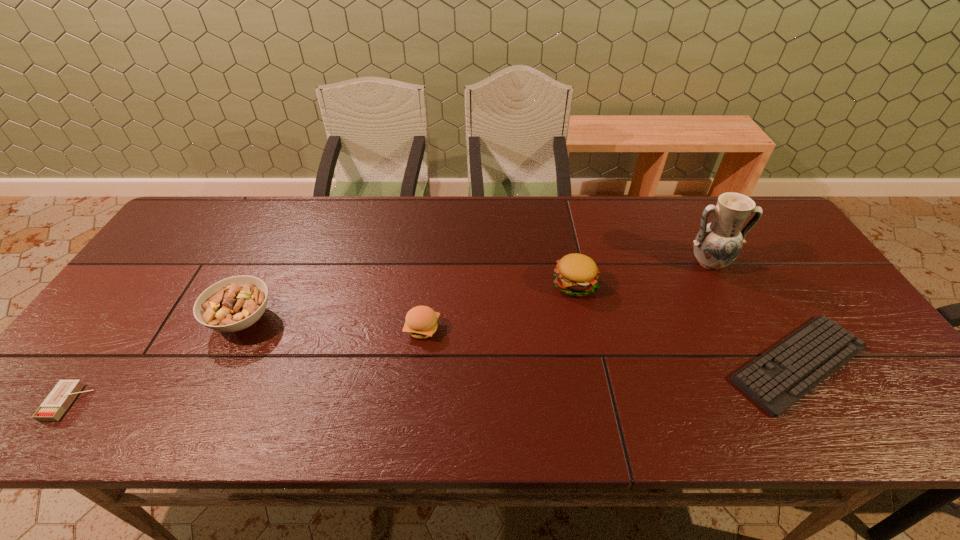
At what (x,y) coordinates should I click in order to perform the action: click on free space between the matchbox and the left hamburger. Please return your answer as a coordinate pair (x, y). This screenshot has width=960, height=540. Looking at the image, I should click on (246, 366).

Identify the location of empty space that is in between the stew and the second shortest object. click(156, 361).

Find the location of `empty space that is in between the shorter hamburger and the shortest object`. empty space that is in between the shorter hamburger and the shortest object is located at coordinates tap(611, 346).

You are a GUI agent. You are given a task and a screenshot of the screen. Output one action in this format:
    pyautogui.click(x=<x>, y=<y>)
    Task: Click on the empty location between the stew and the taller hamburger
    This screenshot has width=960, height=540.
    Given the screenshot: What is the action you would take?
    [x=408, y=302]

Find the location of a particular element. The image size is (960, 540). free space that is in between the shortest object and the stew is located at coordinates (520, 341).

Find the location of a particular element. The image size is (960, 540). free space between the fifth object from right to left and the pottery is located at coordinates (475, 291).

Identify which object is located as the fifth nearest to the nearer hamburger. Please provide its 2D coordinates. Your answer should be formatted as a tuple, i.e. [(x, y)], where the tuple contains the x and y coordinates of a point satisfying the conditions above.

[(717, 244)]

I want to click on the fourth closest object relative to the left hamburger, so click(59, 399).

I want to click on free spot that satisfies the following two spatial constraints: 1. on the front side of the third object from left to right; 2. on the striking surface of the matchbox, so click(414, 402).

Locate an element on the screen. This screenshot has height=540, width=960. vacant space that satisfies the following two spatial constraints: 1. on either side of the pottery; 2. on the striking surface of the fifth tallest object is located at coordinates (783, 402).